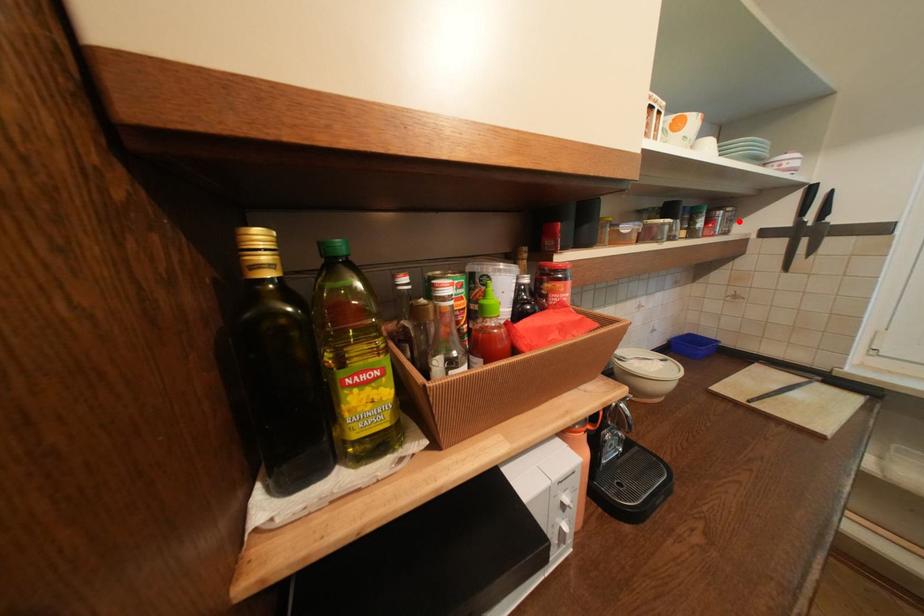
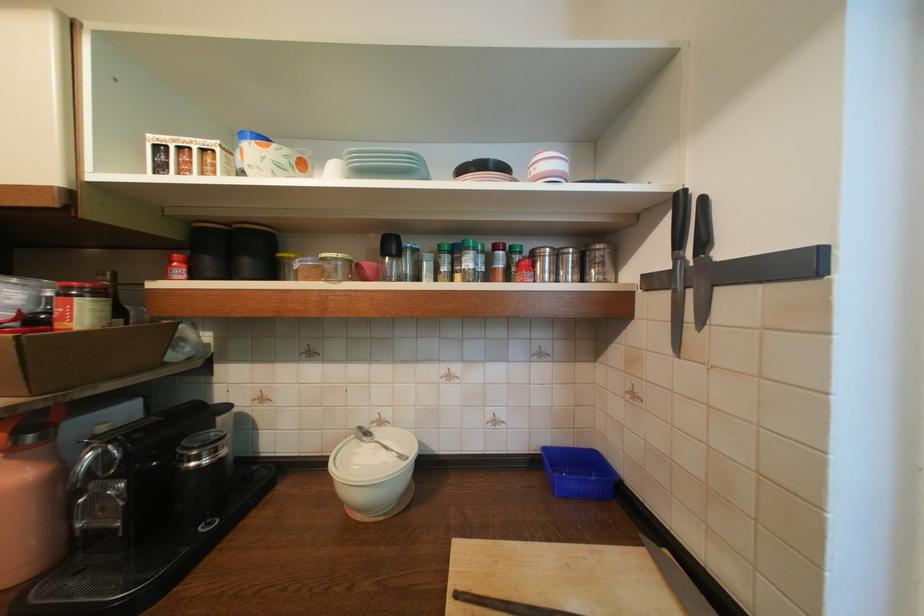
The point at the highlighted location is marked in the first image. Where is the corresponding point in the second image?

(611, 265)